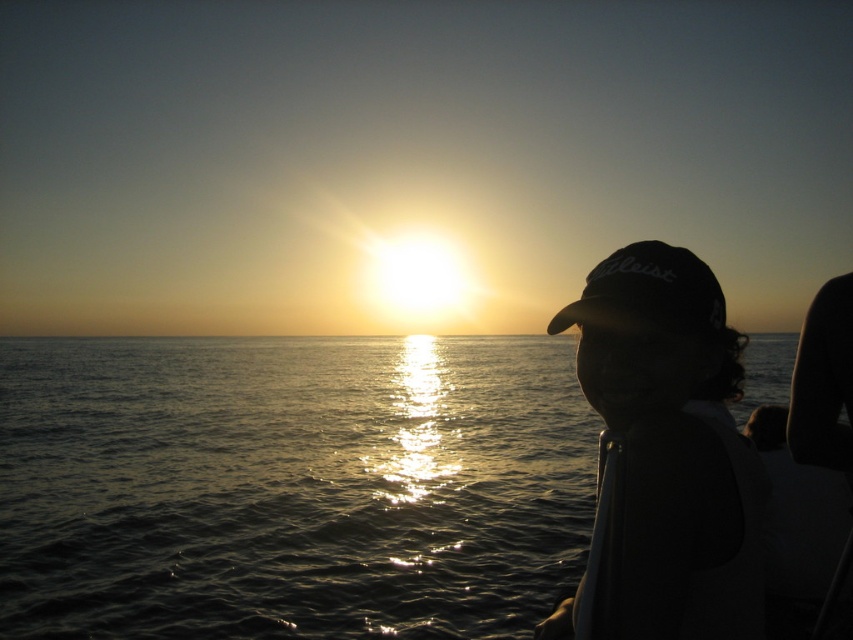
You are a photographer trying to capture the sunset. You notice the shiny reflective water at center and the black matte baseball cap at right. Which object appears larger in the photo?

The shiny reflective water at center appears larger in the photo because it is taller than the black matte baseball cap at right.

You are a photographer trying to capture the sunset reflection on the water. The boat you are on is anchored at coordinates 0.761, 0.341. Can you confirm if the shiny reflective water at center is directly under your boat?

Yes, the shiny reflective water at center is located exactly at the coordinates (289, 486) where the boat is anchored, so it is directly under the boat.